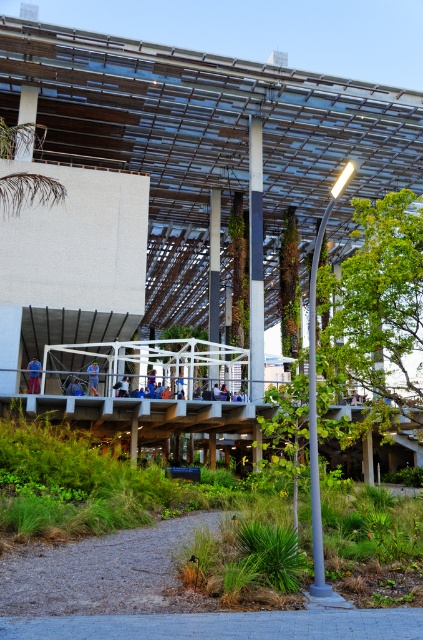
You are a landscape architect designing a new pathway. You want to ensure that the gray concrete path at lower center is wide enough for two people to walk side by side. Given that the green leafy tree at center might be wider than the path, should you consider adjusting the path width?

The green leafy tree at center might be wider than the gray concrete path at lower center, so adjusting the path width could be necessary to ensure adequate space for two people to walk comfortably without encroaching on the tree area.